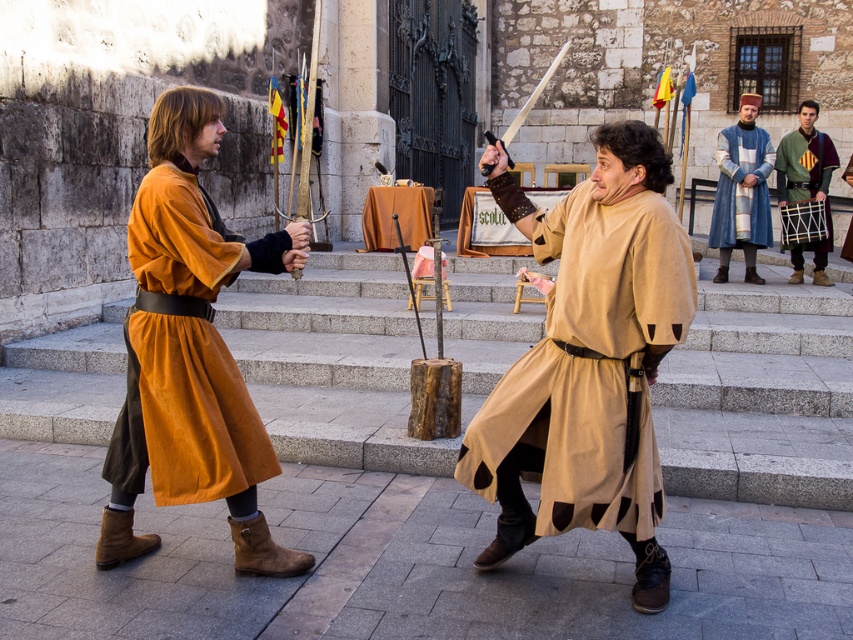
You are a knight in armor standing at the base of the stone building. You need to quickly move from the beige fabric tunic at center to the blue woolen robe at upper right. Can you reach the robe within 3 seconds if you run at a speed of 7 feet per second?

The distance between the beige fabric tunic at center and the blue woolen robe at upper right is 21.60 feet. At a running speed of 7 feet per second, it would take approximately 3.09 seconds to cover the distance. Since this is slightly over 3 seconds, you cannot reach the robe within the time limit.

You are a spectator at the historical reenactment. You see the beige fabric tunic at center and the matte orange robe at left. Which costume is positioned lower in the scene?

The beige fabric tunic at center is below the matte orange robe at left, so the beige fabric tunic at center is positioned lower in the scene.

You are a spectator watching the mock sword fight between the beige fabric tunic at center and the matte orange robe at left. Which fighter is positioned closer to you?

The beige fabric tunic at center is closer to the viewer than the matte orange robe at left.